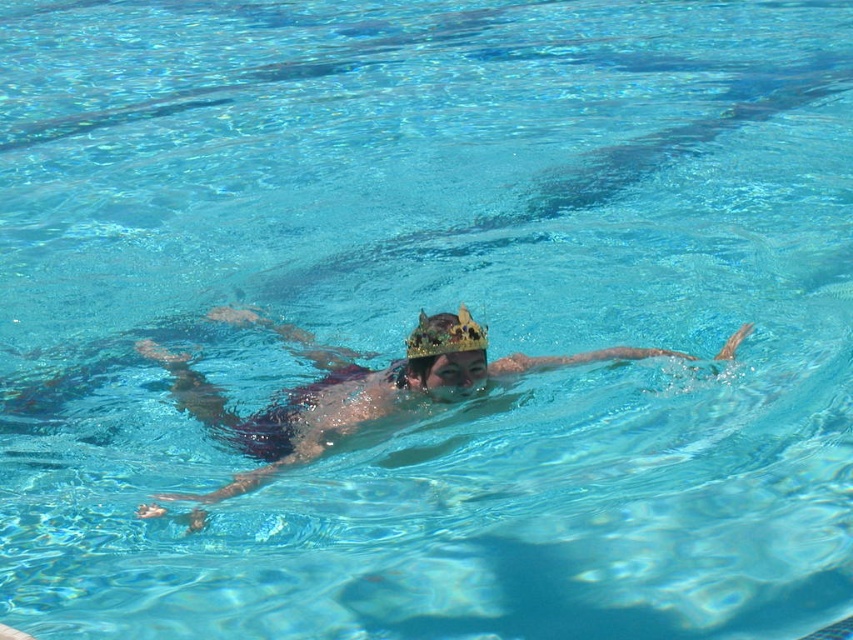
Which is in front, point (456, 384) or point (460, 323)?

Point (460, 323) is in front.

Is point (294, 406) farther from camera compared to point (422, 316)?

Yes.

Is point (148, 509) closer to camera compared to point (466, 310)?

Yes.

Identify the location of metallic gold crown at center. The width and height of the screenshot is (853, 640). (340, 396).